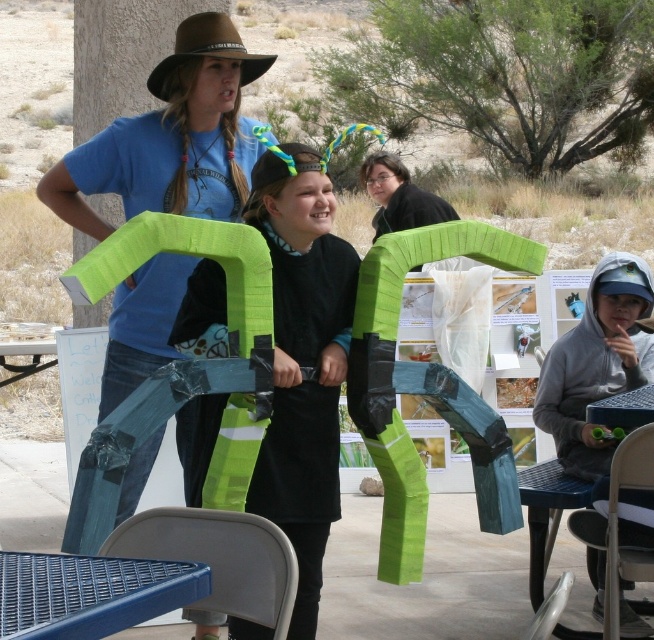
Question: In this image, where is black felt dress at center located relative to brown felt cowboy hat at upper center?

Choices:
 (A) right
 (B) left

Answer: (A)

Question: Which object is the closest to the gray hoodie at lower right?

Choices:
 (A) brown felt cowboy hat at upper center
 (B) black felt dress at center

Answer: (B)

Question: From the image, what is the correct spatial relationship of gray hoodie at lower right in relation to brown felt cowboy hat at upper center?

Choices:
 (A) right
 (B) left

Answer: (A)

Question: Which object appears farthest from the camera in this image?

Choices:
 (A) brown felt cowboy hat at upper center
 (B) blue plastic table at lower left
 (C) black felt dress at center

Answer: (A)

Question: Which is farther from the brown felt cowboy hat at upper center?

Choices:
 (A) black felt dress at center
 (B) blue plastic table at lower left

Answer: (B)

Question: Can you confirm if black felt dress at center is positioned to the left of blue plastic table at lower left?

Choices:
 (A) yes
 (B) no

Answer: (B)